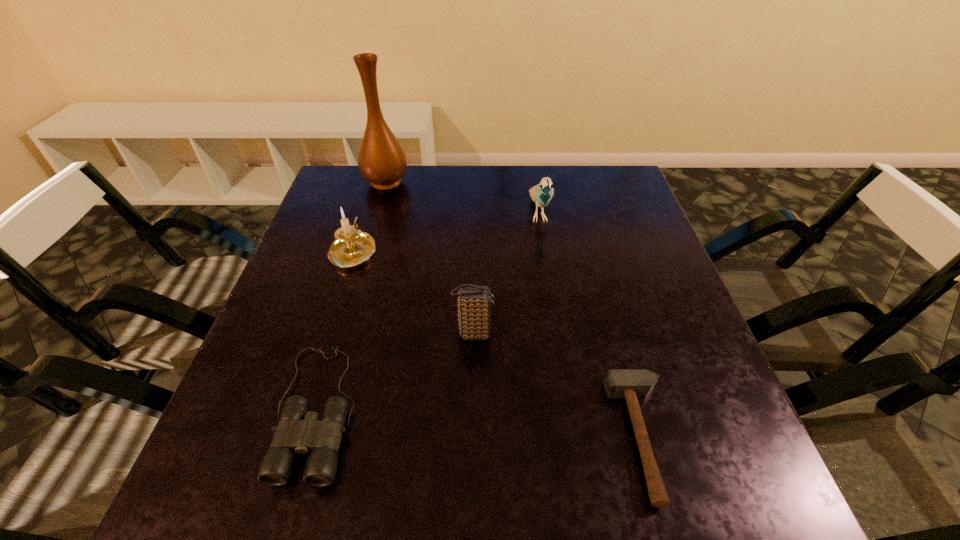
Find the location of a particular element. This screenshot has width=960, height=540. free space located 0.290m on the handle side of the candle holder is located at coordinates (378, 172).

Identify the location of free point located on the handle side of the candle holder. point(364,217).

Locate an element on the screen. The image size is (960, 540). vacant region located on the handle side of the candle holder is located at coordinates (370, 198).

This screenshot has width=960, height=540. In order to click on vacant point located with the zip open on the third object from right to left in this screenshot , I will do `click(562, 334)`.

Locate an element on the screen. The image size is (960, 540). vacant space located 0.250m on the striking surface of the rightmost object is located at coordinates pyautogui.click(x=468, y=438).

You are a GUI agent. You are given a task and a screenshot of the screen. Output one action in this format:
    pyautogui.click(x=<x>, y=<y>)
    Task: Click on the vacant space located 0.070m on the striking surface of the rightmost object
    The height and width of the screenshot is (540, 960).
    Given the screenshot: What is the action you would take?
    pyautogui.click(x=574, y=438)

This screenshot has width=960, height=540. In order to click on vacant space located 0.400m on the striking surface of the rightmost object in this screenshot , I will do `click(379, 438)`.

Locate an element on the screen. This screenshot has width=960, height=540. vase located in the far edge section of the desktop is located at coordinates (382, 161).

The image size is (960, 540). Identify the location of bird that is at the far edge. pyautogui.click(x=541, y=194).

At what (x,y) coordinates should I click in order to perform the action: click on binoculars located in the near edge section of the desktop. Please return your answer as a coordinate pair (x, y). This screenshot has width=960, height=540. Looking at the image, I should click on (298, 431).